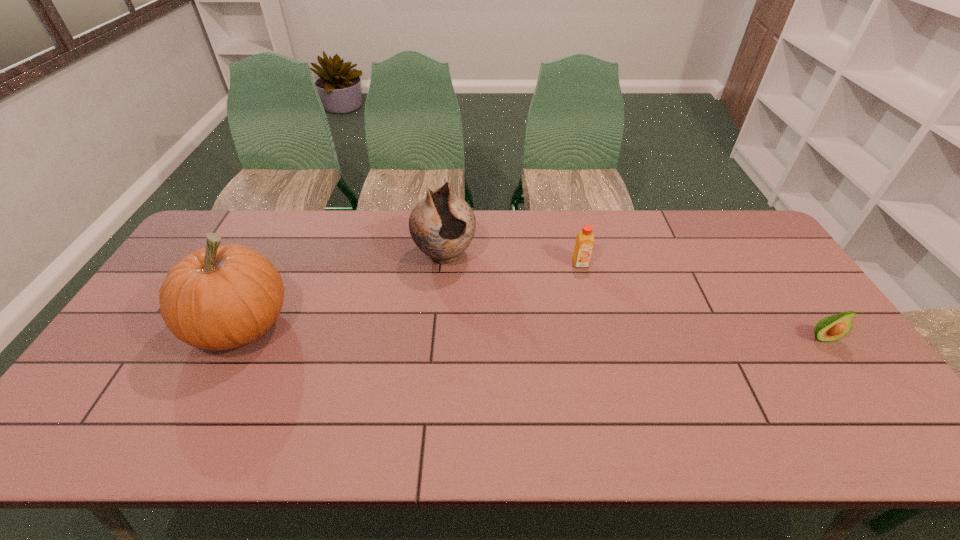
The height and width of the screenshot is (540, 960). Identify the location of free space on the desktop that is between the pumpkin and the rightmost object and is positioned on the front and back of the orange juice. (601, 333).

Where is `free spot on the desktop that is between the pumpkin and the avocado and is positioned from the spout of the pottery`? The height and width of the screenshot is (540, 960). free spot on the desktop that is between the pumpkin and the avocado and is positioned from the spout of the pottery is located at coordinates (485, 330).